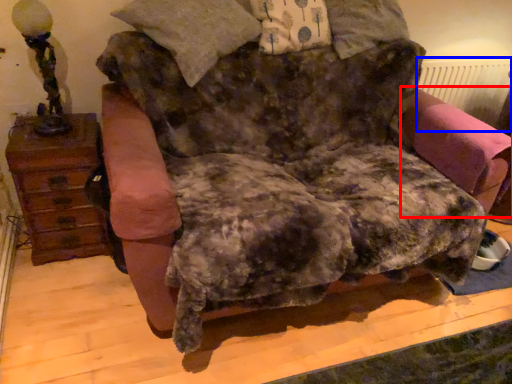
Question: Which point is further to the camera, swivel chair (highlighted by a red box) or radiator (highlighted by a blue box)?

Choices:
 (A) swivel chair
 (B) radiator

Answer: (B)